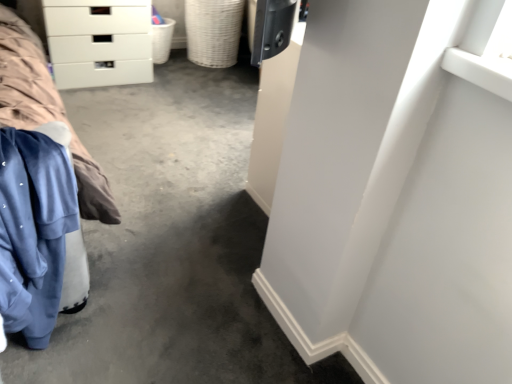
This screenshot has width=512, height=384. Identify the location of vacant space to the right of white plastic basket at upper left, which is the 2th basket from right to left. (184, 66).